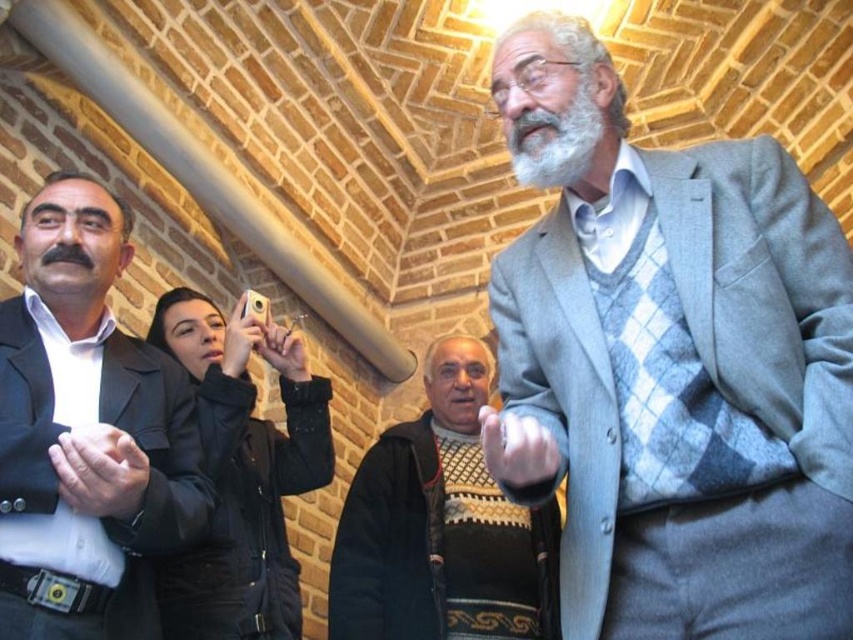
You are standing in the historic building and want to take a photo of the two points mentioned. Which point, point (10,412) or point (514,147), will appear larger in your camera view?

Point (10,412) is closer to the camera than point (514,147), so it will appear larger in the camera view.

You are standing in the historic building and want to take a photo of the point at coordinates (x=738, y=413). The camera you have can focus on objects up to 25 meters away. Will the point be in focus?

The point at coordinates (x=738, y=413) is 25.05 meters from the camera, which is slightly beyond the camera focus limit of 25 meters. Therefore, the point will not be in focus.